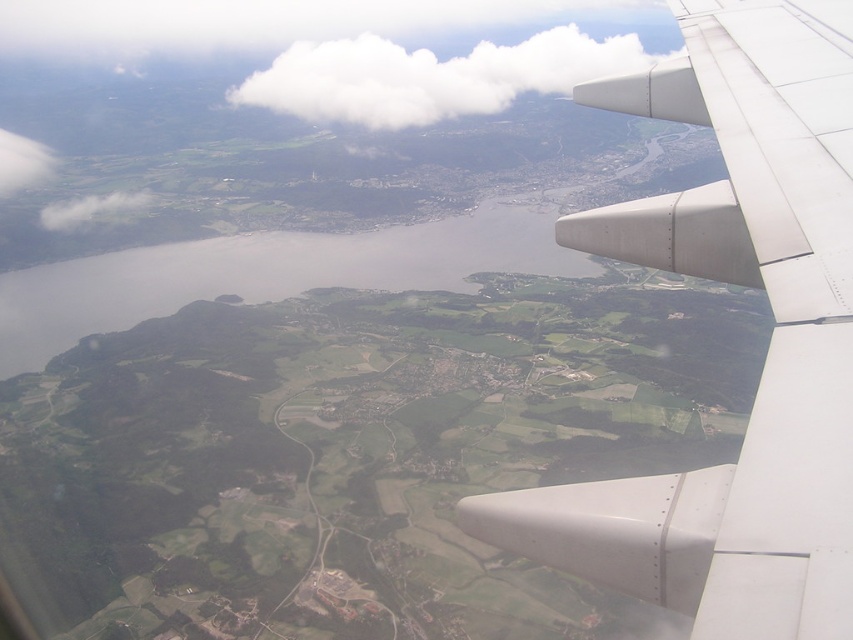
Question: Can you confirm if metallic gray wing at right is bigger than white fluffy cloud at upper center?

Choices:
 (A) yes
 (B) no

Answer: (B)

Question: Is metallic gray wing at right thinner than white fluffy cloud at upper center?

Choices:
 (A) yes
 (B) no

Answer: (A)

Question: Does metallic gray wing at right appear under white fluffy cloud at upper center?

Choices:
 (A) yes
 (B) no

Answer: (A)